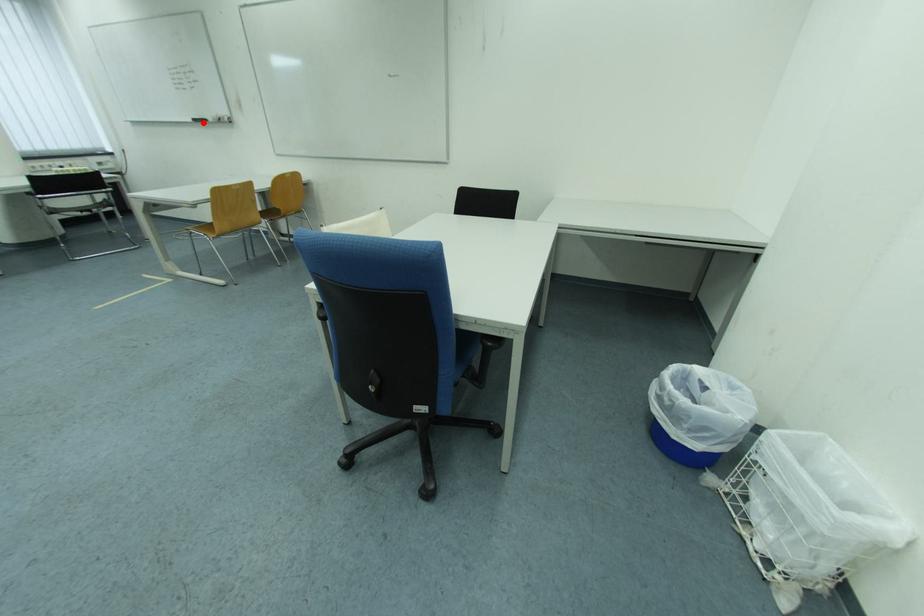
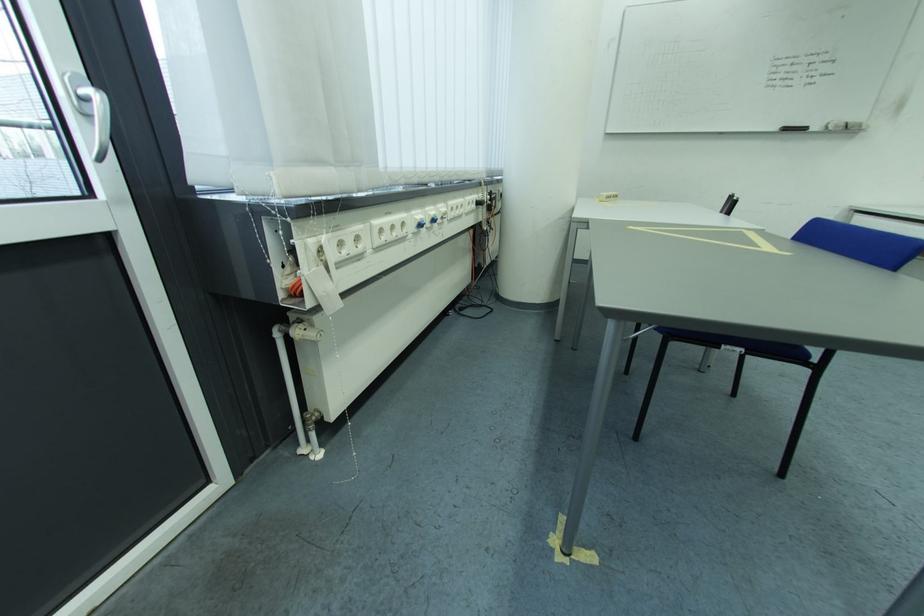
Question: I am providing you with two images of the same scene from different viewpoints. In image1, a red point is highlighted. Considering the same 3D point in image2, which of the following is correct?

Choices:
 (A) It is closer
 (B) It is farther

Answer: (B)